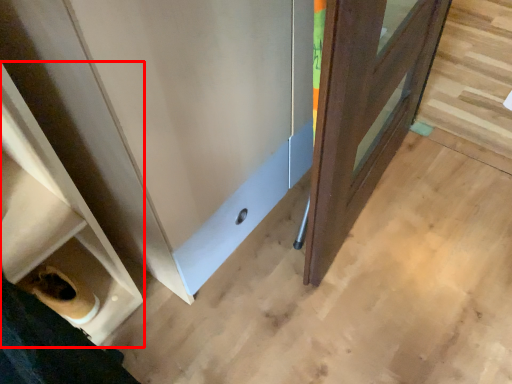
Question: From the image's perspective, what is the correct spatial relationship of shelf (annotated by the red box) in relation to door?

Choices:
 (A) below
 (B) above

Answer: (A)